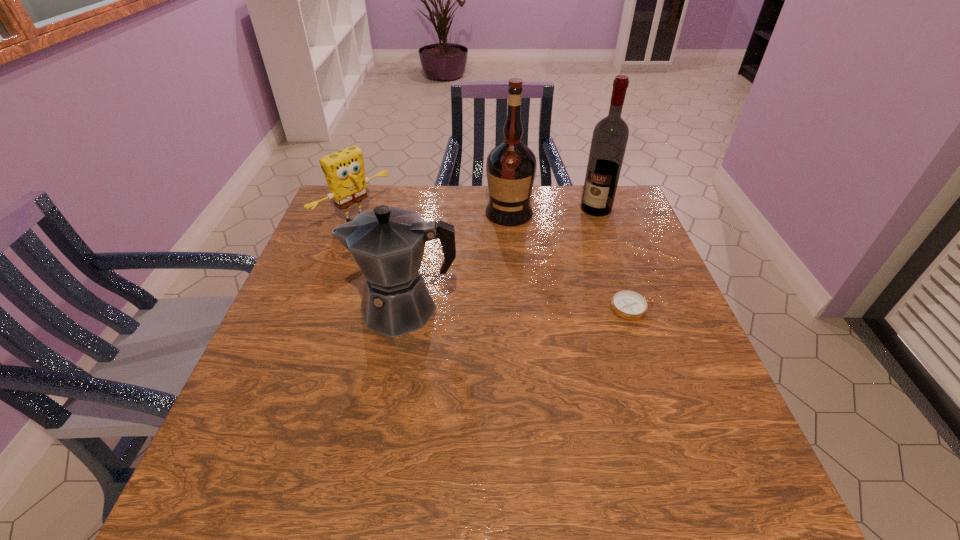
Where is `vacant space located on the front and back of the alcohol`? vacant space located on the front and back of the alcohol is located at coordinates (570, 246).

The image size is (960, 540). Find the location of `free region located 0.080m on the front and back of the alcohol`. free region located 0.080m on the front and back of the alcohol is located at coordinates (582, 230).

Where is `blank space located on the surface of the liquor`? This screenshot has width=960, height=540. blank space located on the surface of the liquor is located at coordinates (498, 256).

Find the location of `free location located on the surface of the liquor`. free location located on the surface of the liquor is located at coordinates (490, 292).

Where is `vacant space located on the surface of the liquor`? vacant space located on the surface of the liquor is located at coordinates (501, 243).

What are the coordinates of `free region located on the face of the sponge` in the screenshot? It's located at [x=420, y=264].

Image resolution: width=960 pixels, height=540 pixels. I want to click on free space located on the face of the sponge, so click(x=397, y=247).

Locate an element on the screen. This screenshot has height=540, width=960. free space located on the face of the sponge is located at coordinates (406, 254).

What are the coordinates of `alcohol that is at the far edge` in the screenshot? It's located at click(609, 140).

This screenshot has width=960, height=540. I want to click on liquor at the far edge, so click(511, 166).